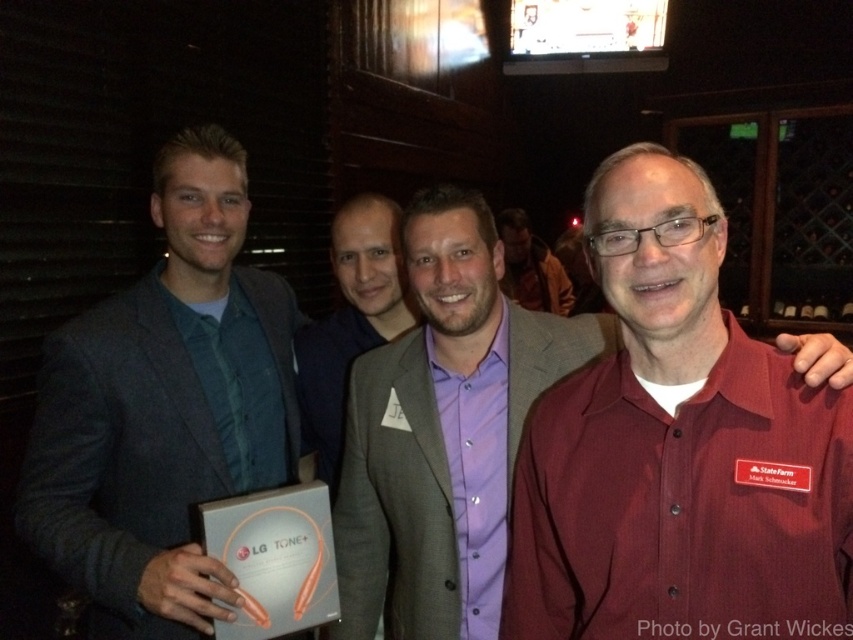
From the picture: Which is more to the left, purple fabric shirt at center or purple satin shirt at center?

Positioned to the left is purple fabric shirt at center.

Does point (329, 410) come behind point (519, 268)?

No, (329, 410) is in front of (519, 268).

This screenshot has height=640, width=853. Find the location of `purple fabric shirt at center`. purple fabric shirt at center is located at coordinates click(349, 324).

Does matte gray suit at left have a greater width compared to purple fabric shirt at center?

Yes.

Who is lower down, matte gray suit at left or purple fabric shirt at center?

Positioned lower is matte gray suit at left.

Locate an element on the screen. matte gray suit at left is located at coordinates (164, 408).

Locate an element on the screen. matte gray suit at left is located at coordinates (164, 408).

Who is more distant from viewer, (514, 426) or (521, 227)?

The point (521, 227) is behind.

Is maroon button-down shirt at center behind purple satin shirt at center?

No, maroon button-down shirt at center is closer to the viewer.

What do you see at coordinates (444, 432) in the screenshot?
I see `maroon button-down shirt at center` at bounding box center [444, 432].

The height and width of the screenshot is (640, 853). I want to click on maroon button-down shirt at center, so click(444, 432).